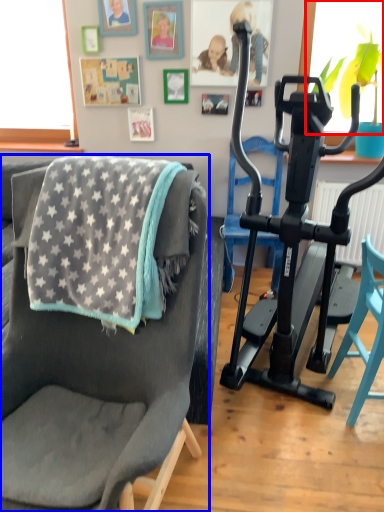
Question: Which object is further to the camera taking this photo, window screen (highlighted by a red box) or chair (highlighted by a blue box)?

Choices:
 (A) window screen
 (B) chair

Answer: (A)